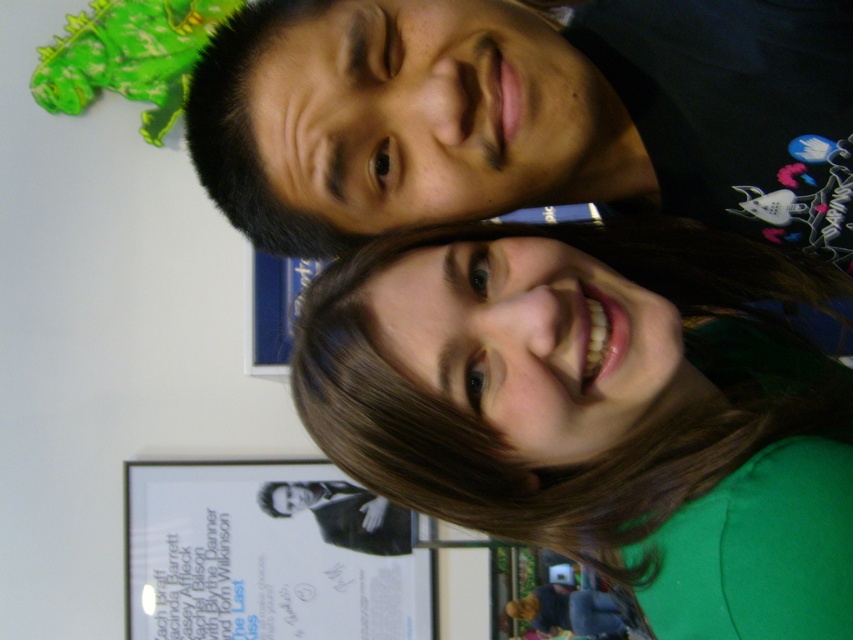
Question: From the image, what is the correct spatial relationship of green matte shirt at lower right in relation to black suit at center?

Choices:
 (A) left
 (B) right

Answer: (B)

Question: Which point is farther to the camera?

Choices:
 (A) black suit at center
 (B) matte black shirt at upper center
 (C) green matte shirt at lower right

Answer: (A)

Question: Observing the image, what is the correct spatial positioning of green matte shirt at lower right in reference to matte black shirt at upper center?

Choices:
 (A) below
 (B) above

Answer: (A)

Question: Which of the following is the closest to the observer?

Choices:
 (A) (279, 499)
 (B) (635, 193)

Answer: (B)

Question: Where is green matte shirt at lower right located in relation to black suit at center in the image?

Choices:
 (A) below
 (B) above

Answer: (B)

Question: Which point is closer to the camera?

Choices:
 (A) matte black shirt at upper center
 (B) black suit at center
 (C) green matte shirt at lower right

Answer: (A)